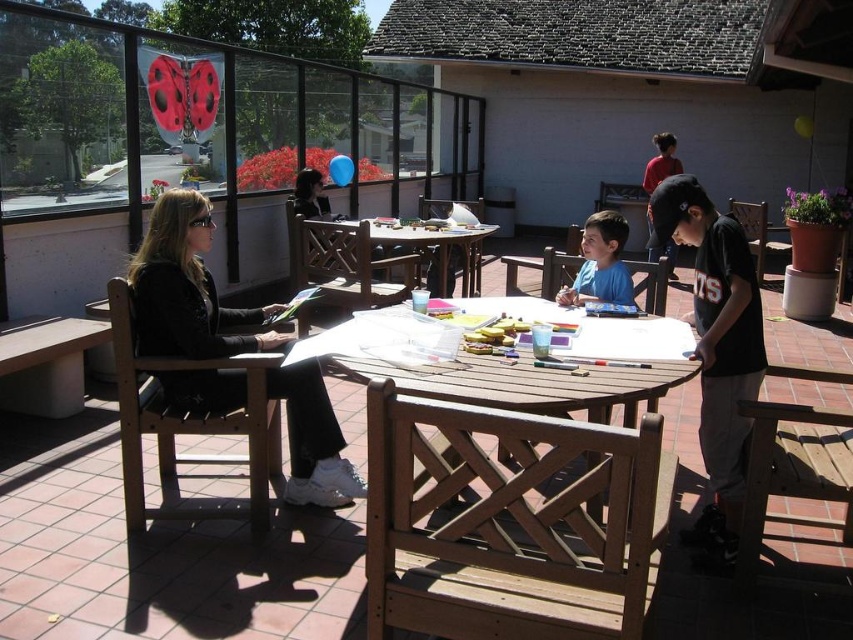
You are organizing a small art workshop and need to ensure there is enough space for participants. Given the wooden picnic table at center and the black cotton shirt at center, which object is wider?

The wooden picnic table at center is wider than the black cotton shirt at center.

You are standing at the edge of the courtyard and want to reach the closest point between point [538,392] and point [743,316]. Which point should you head towards?

Point [538,392] is closer to the viewer than point [743,316], so you should head towards point [538,392].

You are standing at the point with coordinates point (625,272) and want to move to the point with coordinates point (691,358). Is the point you want to reach located in front of you or behind you?

The point (691,358) is in front of point (625,272), so the point you want to reach is located in front of you.